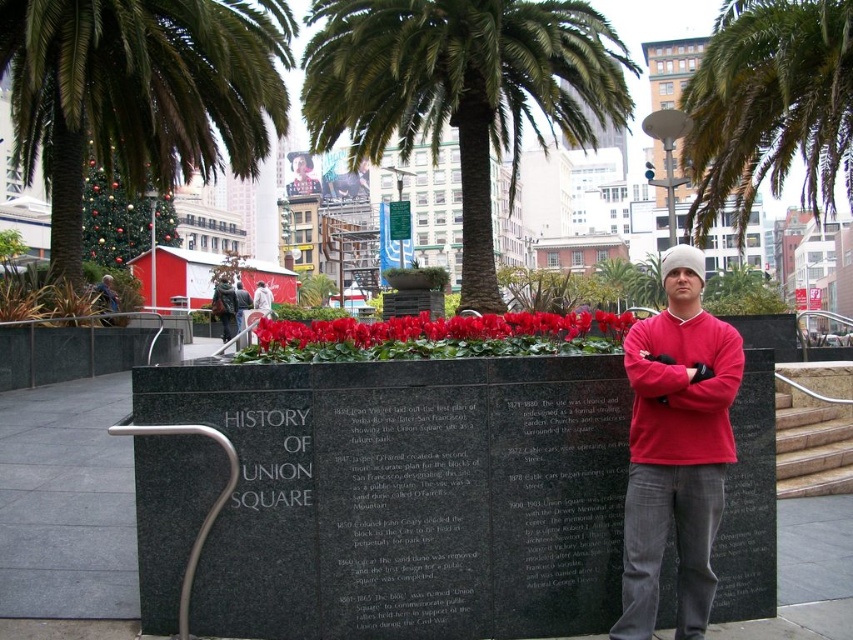
Question: Considering the relative positions of green leafy palm tree at center and matte red sweater at center in the image provided, where is green leafy palm tree at center located with respect to matte red sweater at center?

Choices:
 (A) left
 (B) right

Answer: (B)

Question: Which is farther from the green leafy palm tree at left?

Choices:
 (A) matte red sweater at center
 (B) black granite plaque at center
 (C) red velvet flowers at center

Answer: (A)

Question: Which point is farther from the camera taking this photo?

Choices:
 (A) (218, 316)
 (B) (827, 1)
 (C) (532, 113)
 (D) (344, 328)

Answer: (C)

Question: Does matte red sweater at center appear on the left side of green leafy palm tree at upper center?

Choices:
 (A) yes
 (B) no

Answer: (A)

Question: Which point is farther to the camera?

Choices:
 (A) white cotton shirt at center
 (B) green leafy palm tree at center
 (C) matte red sweater at center
 (D) green leafy palm tree at left

Answer: (A)

Question: Can you confirm if matte red sweater at center is positioned below black granite plaque at center?

Choices:
 (A) no
 (B) yes

Answer: (A)